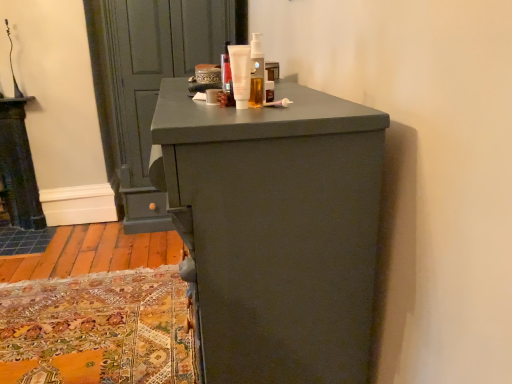
Where is `vacant space in front of translucent plastic bottle at upper center, which is the 3th toiletry from left to right`? This screenshot has width=512, height=384. vacant space in front of translucent plastic bottle at upper center, which is the 3th toiletry from left to right is located at coordinates (227, 114).